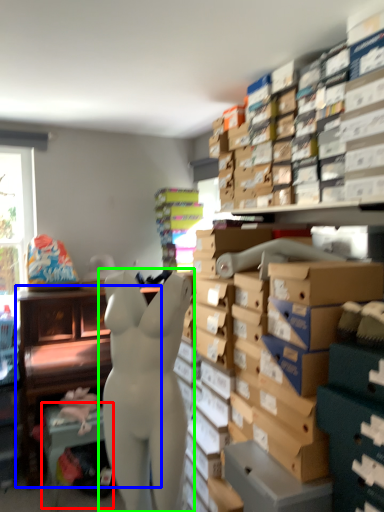
Question: Which object is positioned closest to table (highlighted by a red box)? Select from furniture (highlighted by a blue box) and person (highlighted by a green box).

Choices:
 (A) furniture
 (B) person

Answer: (A)